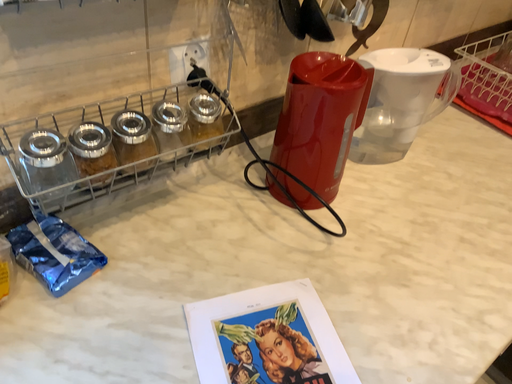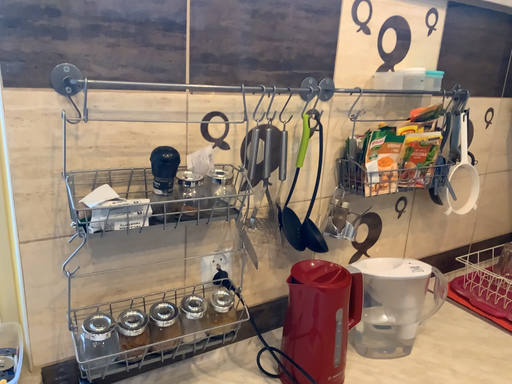
Question: Which way did the camera rotate in the video?

Choices:
 (A) rotated upward
 (B) rotated downward

Answer: (A)